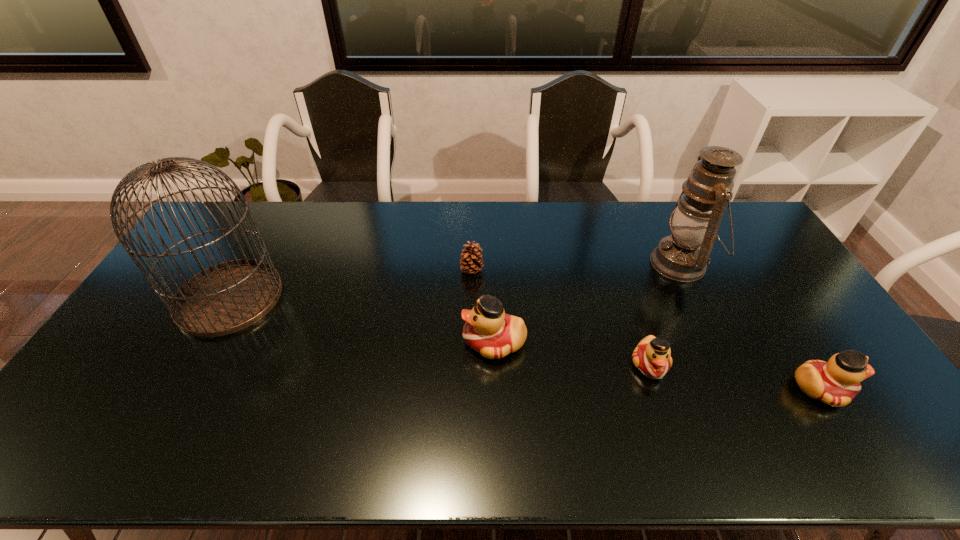
In order to click on duck that can be found as the second closest to the leftmost duck in this screenshot , I will do `click(836, 382)`.